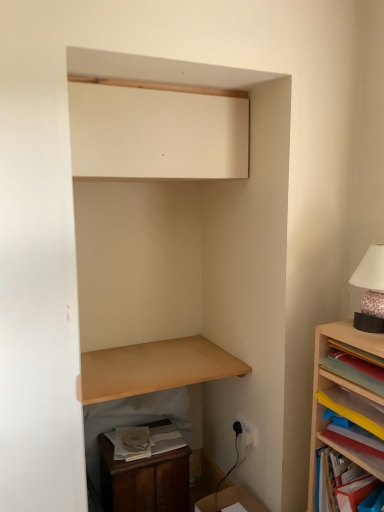
Question: Is matte white cabinet at upper center next to white paper at lower left?

Choices:
 (A) yes
 (B) no

Answer: (B)

Question: Does matte white cabinet at upper center have a lesser width compared to white paper at lower left?

Choices:
 (A) yes
 (B) no

Answer: (B)

Question: Does matte white cabinet at upper center turn towards white paper at lower left?

Choices:
 (A) yes
 (B) no

Answer: (B)

Question: From the image's perspective, is matte white cabinet at upper center under white paper at lower left?

Choices:
 (A) no
 (B) yes

Answer: (A)

Question: From a real-world perspective, is matte white cabinet at upper center physically below white paper at lower left?

Choices:
 (A) no
 (B) yes

Answer: (A)

Question: Would you consider matte white cabinet at upper center to be distant from white paper at lower left?

Choices:
 (A) no
 (B) yes

Answer: (B)

Question: From a real-world perspective, is white paper at lower left under light brown wood shelf at lower center, which ranks as the third shelf in right-to-left order?

Choices:
 (A) yes
 (B) no

Answer: (A)

Question: From the image's perspective, is white paper at lower left below light brown wood shelf at lower center, which ranks as the third shelf in right-to-left order?

Choices:
 (A) yes
 (B) no

Answer: (A)

Question: Is white paper at lower left taller than light brown wood shelf at lower center, acting as the first shelf starting from the left?

Choices:
 (A) no
 (B) yes

Answer: (B)

Question: From a real-world perspective, is white paper at lower left on top of light brown wood shelf at lower center, acting as the first shelf starting from the left?

Choices:
 (A) no
 (B) yes

Answer: (A)

Question: Is white paper at lower left further to the viewer compared to light brown wood shelf at lower center, acting as the first shelf starting from the left?

Choices:
 (A) no
 (B) yes

Answer: (B)

Question: Is white paper at lower left not inside light brown wood shelf at lower center, which ranks as the third shelf in right-to-left order?

Choices:
 (A) yes
 (B) no

Answer: (A)

Question: Does wooden dresser at lower left have a greater height compared to light brown wood shelf at lower center, acting as the first shelf starting from the left?

Choices:
 (A) yes
 (B) no

Answer: (A)